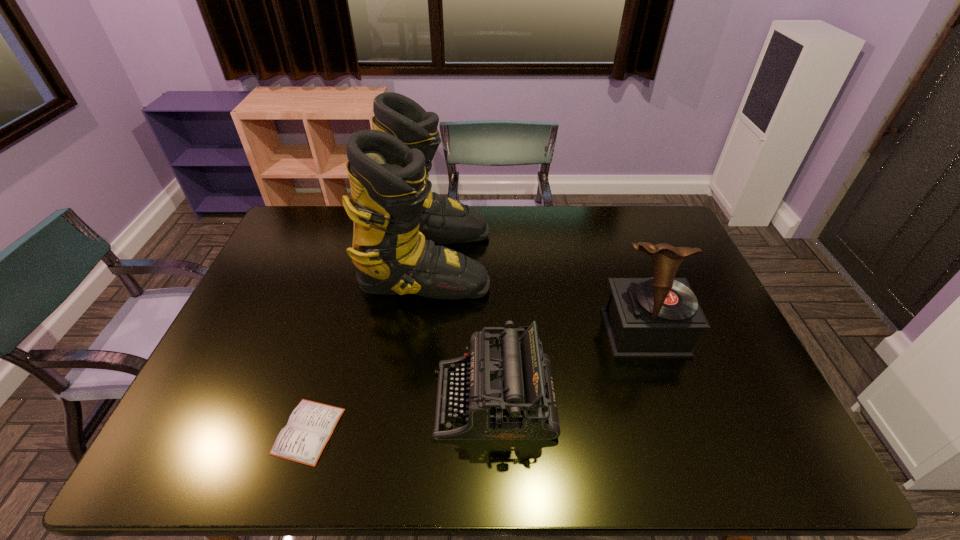
Locate an element on the screen. This screenshot has width=960, height=540. ski boots is located at coordinates (397, 218).

Locate an element on the screen. The height and width of the screenshot is (540, 960). the rightmost object is located at coordinates (659, 317).

At what (x,y) coordinates should I click in order to perform the action: click on the third shortest object. Please return your answer as a coordinate pair (x, y). Looking at the image, I should click on (659, 317).

Locate an element on the screen. This screenshot has height=540, width=960. typewriter is located at coordinates (508, 393).

Locate an element on the screen. The image size is (960, 540). the shortest object is located at coordinates (311, 424).

You are a GUI agent. You are given a task and a screenshot of the screen. Output one action in this format:
    pyautogui.click(x=<x>, y=<y>)
    Task: Click on the blank space located on the right of the ski boots
    This screenshot has height=540, width=960.
    Given the screenshot: What is the action you would take?
    pyautogui.click(x=567, y=261)

This screenshot has width=960, height=540. I want to click on vacant area situated at the horn opening of the third shortest object, so click(666, 395).

At what (x,y) coordinates should I click in order to perform the action: click on blank area located on the keyboard of the typewriter. Please return your answer as a coordinate pair (x, y). Looking at the image, I should click on (341, 400).

The image size is (960, 540). What are the coordinates of `free space located 0.260m on the keyboard of the typewriter` in the screenshot? It's located at (328, 400).

This screenshot has height=540, width=960. Identify the location of free space located on the keyboard of the typewriter. (337, 400).